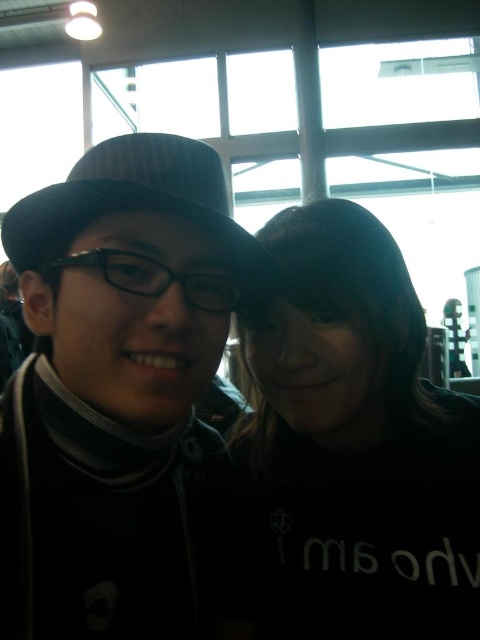
You are a photographer adjusting the focus of your camera. You notice two points in the scene labeled as point [67,188] and point [322,438]. Which point should you focus on to ensure the subject closest to the camera is sharp?

You should focus on point [67,188] because it is closer to the camera than point [322,438].

You are a photographer trying to place a 10 cm wide decorative item between the matte black hat at left and the black felt hat at center. Based on their widths, will the item fit without overlapping either hat?

The matte black hat at left is narrower than the black felt hat at center. Since the decorative item is 10 cm wide, it depends on the space between them. However, the description only provides width comparisons, not spacing. Without knowing the distance between the hats, we cannot confirm if the item will fit.